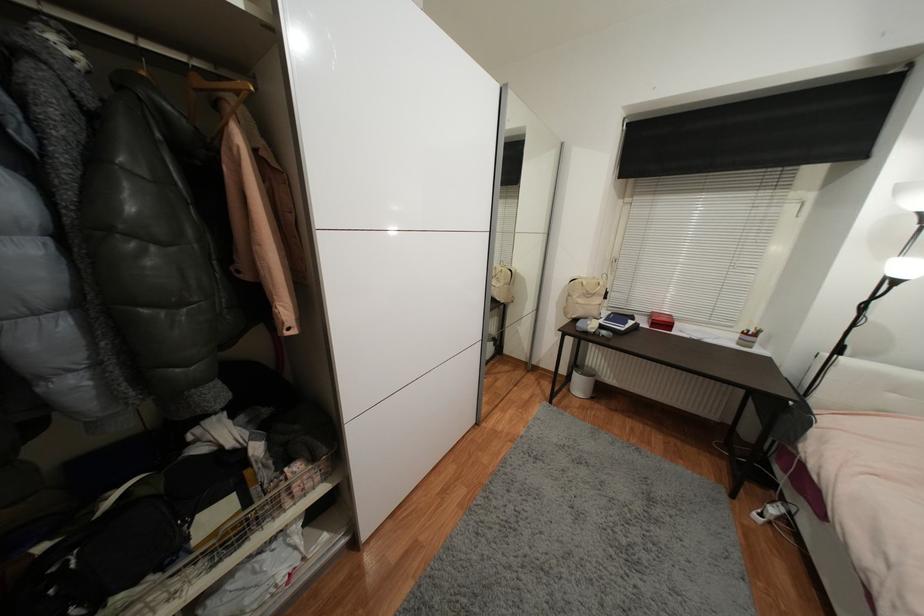
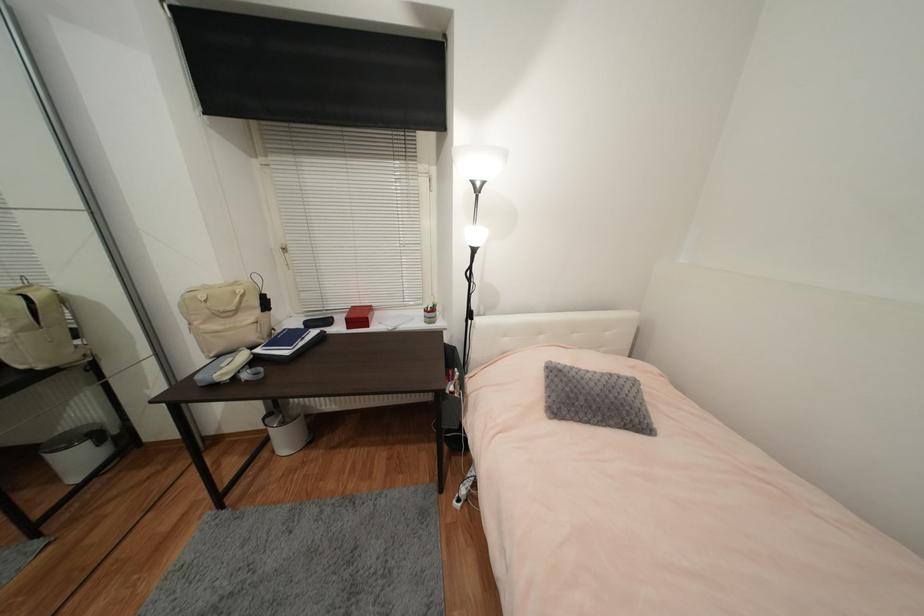
The point at (x=631, y=326) is marked in the first image. Where is the corresponding point in the second image?

(306, 344)